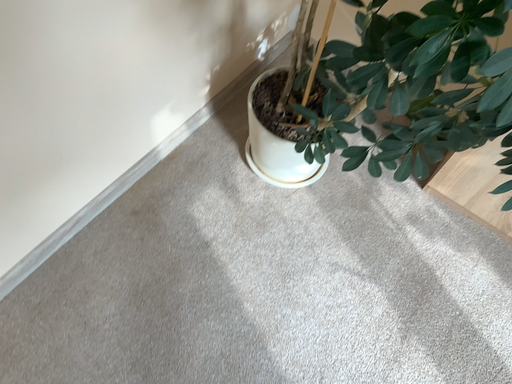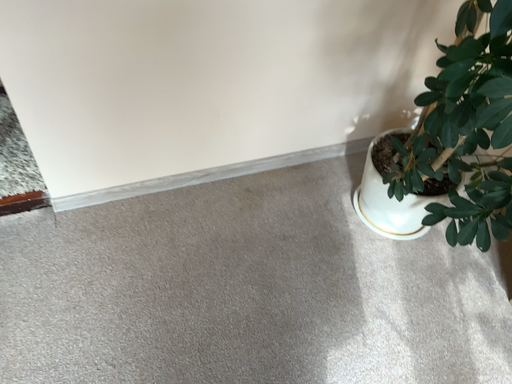
Question: Which way did the camera rotate in the video?

Choices:
 (A) rotated upward
 (B) rotated downward

Answer: (A)